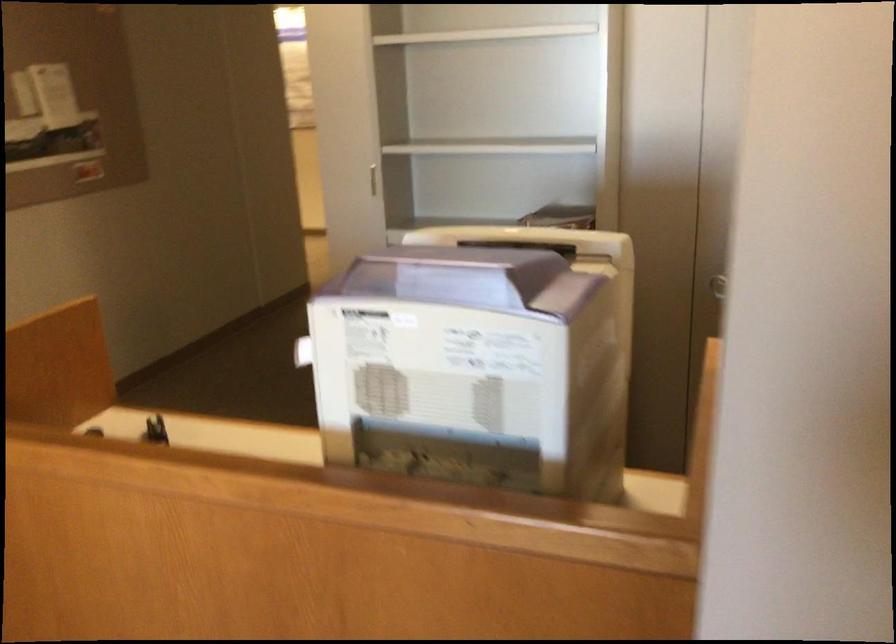
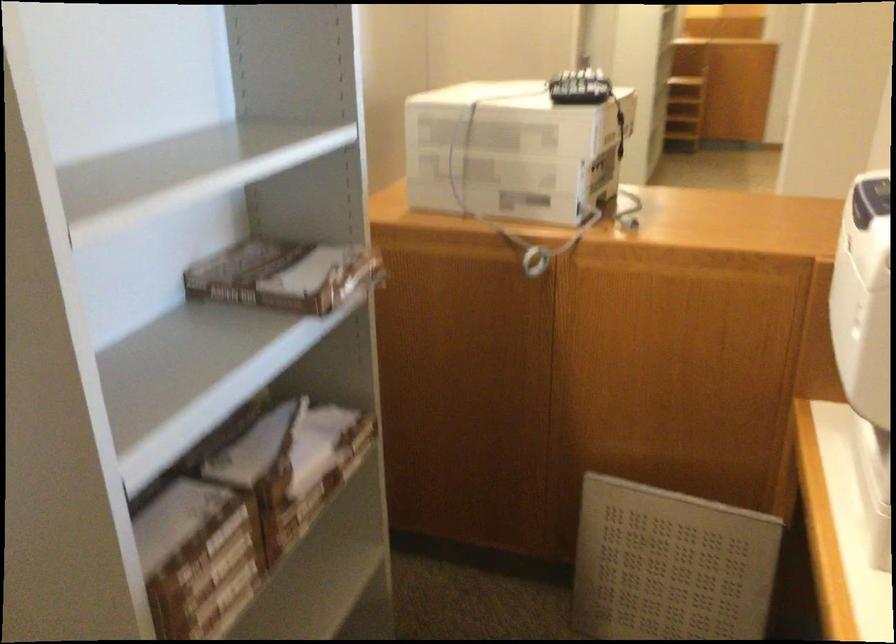
Find the pixel in the second image that matches (x=547, y=204) in the first image.

(280, 275)